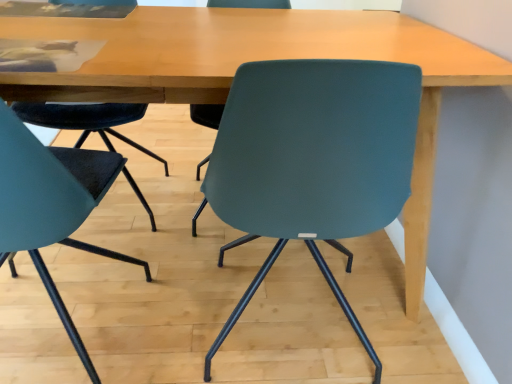
Question: From a real-world perspective, is teal matte chair at center, the 1th chair when ordered from right to left, positioned above or below teal matte chair at left, positioned as the first chair in left-to-right order?

Choices:
 (A) below
 (B) above

Answer: (A)

Question: In terms of width, does teal matte chair at center, the 1th chair when ordered from right to left, look wider or thinner when compared to teal matte chair at left, positioned as the first chair in left-to-right order?

Choices:
 (A) thin
 (B) wide

Answer: (B)

Question: Would you say teal matte chair at center, the 1th chair when ordered from right to left, is to the left or to the right of teal matte chair at left, the 2th chair viewed from the right, in the picture?

Choices:
 (A) right
 (B) left

Answer: (A)

Question: Do you think teal matte chair at left, positioned as the first chair in left-to-right order, is within teal matte chair at center, the 1th chair when ordered from right to left, or outside of it?

Choices:
 (A) inside
 (B) outside

Answer: (B)

Question: From the image's perspective, is teal matte chair at left, the 2th chair viewed from the right, located above or below teal matte chair at center, the 1th chair when ordered from right to left?

Choices:
 (A) above
 (B) below

Answer: (B)

Question: Considering the positions of teal matte chair at left, the 2th chair viewed from the right, and teal matte chair at center, which is the 2th chair from left to right, in the image, is teal matte chair at left, the 2th chair viewed from the right, taller or shorter than teal matte chair at center, which is the 2th chair from left to right,?

Choices:
 (A) short
 (B) tall

Answer: (B)

Question: Is point (78, 340) closer or farther from the camera than point (221, 337)?

Choices:
 (A) closer
 (B) farther

Answer: (A)